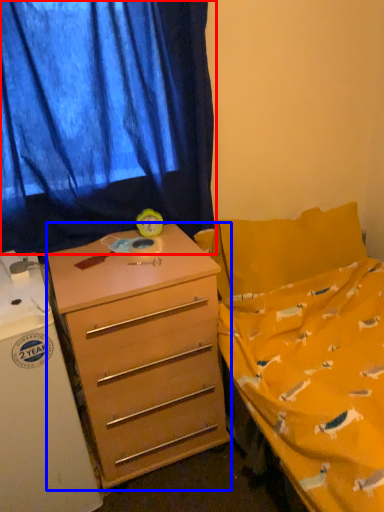
Question: Which object appears closest to the camera in this image, curtain (highlighted by a red box) or desk (highlighted by a blue box)?

Choices:
 (A) curtain
 (B) desk

Answer: (B)